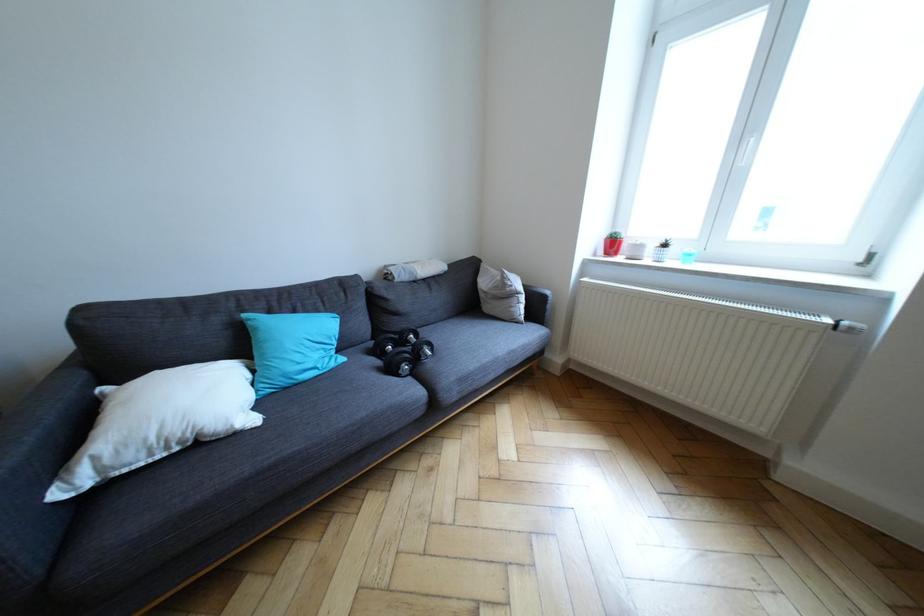
Where is `small white pot`? small white pot is located at coordinates (634, 249).